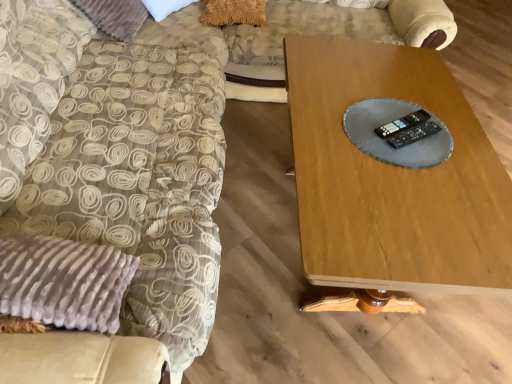
Question: Which direction should I rotate to look at black plastic remote at center, the first control positioned from the top?

Choices:
 (A) left
 (B) right

Answer: (B)

Question: Is black plastic remote at center, which is the first control from bottom to top, behind black plastic remote at center, which appears as the second control when ordered from the bottom?

Choices:
 (A) yes
 (B) no

Answer: (B)

Question: Does black plastic remote at center, the 2th control in the top-to-bottom sequence, have a lesser height compared to black plastic remote at center, the first control positioned from the top?

Choices:
 (A) yes
 (B) no

Answer: (B)

Question: Is black plastic remote at center, which is the first control from bottom to top, wider than black plastic remote at center, the first control positioned from the top?

Choices:
 (A) yes
 (B) no

Answer: (B)

Question: Could you tell me if black plastic remote at center, the 2th control in the top-to-bottom sequence, is facing black plastic remote at center, the first control positioned from the top?

Choices:
 (A) yes
 (B) no

Answer: (A)

Question: Does black plastic remote at center, which is the first control from bottom to top, come in front of black plastic remote at center, the first control positioned from the top?

Choices:
 (A) no
 (B) yes

Answer: (B)

Question: Is black plastic remote at center, the 2th control in the top-to-bottom sequence, located outside black plastic remote at center, which appears as the second control when ordered from the bottom?

Choices:
 (A) no
 (B) yes

Answer: (B)

Question: Can you confirm if black plastic remote at center, which appears as the second control when ordered from the bottom, is taller than velvet beige swivel chair at left?

Choices:
 (A) no
 (B) yes

Answer: (A)

Question: Is black plastic remote at center, which appears as the second control when ordered from the bottom, positioned in front of velvet beige swivel chair at left?

Choices:
 (A) no
 (B) yes

Answer: (A)

Question: Are black plastic remote at center, which appears as the second control when ordered from the bottom, and velvet beige swivel chair at left far apart?

Choices:
 (A) no
 (B) yes

Answer: (A)

Question: Is black plastic remote at center, the first control positioned from the top, oriented away from velvet beige swivel chair at left?

Choices:
 (A) no
 (B) yes

Answer: (A)

Question: Is black plastic remote at center, the first control positioned from the top, to the right of velvet beige swivel chair at left from the viewer's perspective?

Choices:
 (A) yes
 (B) no

Answer: (A)

Question: Is velvet beige swivel chair at left completely or partially inside black plastic remote at center, the first control positioned from the top?

Choices:
 (A) yes
 (B) no

Answer: (B)

Question: Is black plastic remote at center, which appears as the second control when ordered from the bottom, bigger than wooden table at center?

Choices:
 (A) no
 (B) yes

Answer: (A)